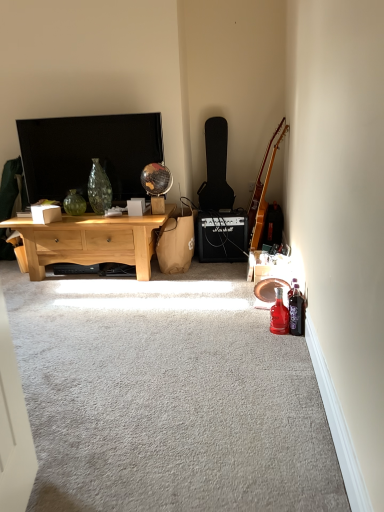
You are a GUI agent. You are given a task and a screenshot of the screen. Output one action in this format:
    pyautogui.click(x=<x>, y=<y>)
    Task: Click on the free space in front of brown paper bag at center
    
    Given the screenshot: What is the action you would take?
    pyautogui.click(x=191, y=276)